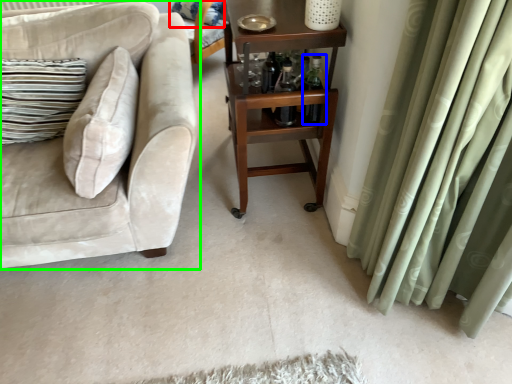
Question: Estimate the real-world distances between objects in this image. Which object is closer to pillow (highlighted by a red box), bottle (highlighted by a blue box) or studio couch (highlighted by a green box)?

Choices:
 (A) bottle
 (B) studio couch

Answer: (B)